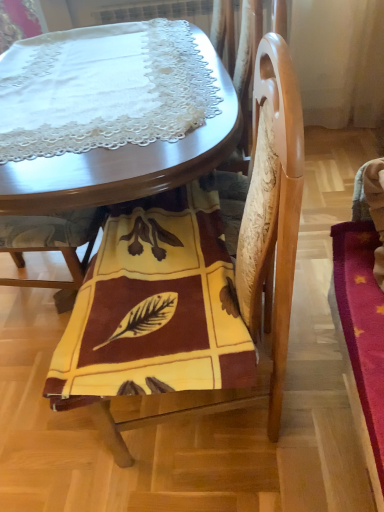
Question: Is yellow fabric chair at center, marked as the first chair in a left-to-right arrangement, located outside yellow fabric at lower center?

Choices:
 (A) yes
 (B) no

Answer: (A)

Question: Can you confirm if yellow fabric chair at center, which appears as the second chair when viewed from the right, is positioned to the right of yellow fabric at lower center?

Choices:
 (A) yes
 (B) no

Answer: (B)

Question: Considering the relative sizes of yellow fabric chair at center, which appears as the second chair when viewed from the right, and yellow fabric at lower center in the image provided, is yellow fabric chair at center, which appears as the second chair when viewed from the right, bigger than yellow fabric at lower center?

Choices:
 (A) no
 (B) yes

Answer: (B)

Question: Can you confirm if yellow fabric chair at center, which appears as the second chair when viewed from the right, is taller than yellow fabric at lower center?

Choices:
 (A) yes
 (B) no

Answer: (A)

Question: Is yellow fabric chair at center, which appears as the second chair when viewed from the right, behind yellow fabric at lower center?

Choices:
 (A) no
 (B) yes

Answer: (B)

Question: In terms of size, does yellow fabric at lower center appear bigger or smaller than wooden table at center?

Choices:
 (A) big
 (B) small

Answer: (B)

Question: From a real-world perspective, relative to wooden table at center, is yellow fabric at lower center vertically above or below?

Choices:
 (A) below
 (B) above

Answer: (B)

Question: Considering the positions of yellow fabric at lower center and wooden table at center in the image, is yellow fabric at lower center wider or thinner than wooden table at center?

Choices:
 (A) thin
 (B) wide

Answer: (A)

Question: Considering their positions, is yellow fabric at lower center located in front of or behind wooden table at center?

Choices:
 (A) behind
 (B) front

Answer: (B)

Question: Considering their positions, is yellow woolen blanket at center, which is the 2th chair from left to right, located in front of or behind yellow fabric chair at center, marked as the first chair in a left-to-right arrangement?

Choices:
 (A) behind
 (B) front

Answer: (B)

Question: Considering the relative positions of yellow woolen blanket at center, which is the 2th chair from left to right, and yellow fabric chair at center, which appears as the second chair when viewed from the right, in the image provided, is yellow woolen blanket at center, which is the 2th chair from left to right, to the left or to the right of yellow fabric chair at center, which appears as the second chair when viewed from the right,?

Choices:
 (A) right
 (B) left

Answer: (A)

Question: From the image's perspective, relative to yellow fabric chair at center, which appears as the second chair when viewed from the right, is yellow woolen blanket at center, which is the 2th chair from left to right, above or below?

Choices:
 (A) below
 (B) above

Answer: (A)

Question: Considering the positions of point (97, 326) and point (29, 248), is point (97, 326) closer or farther from the camera than point (29, 248)?

Choices:
 (A) closer
 (B) farther

Answer: (A)

Question: From the image's perspective, is yellow fabric chair at center, which appears as the second chair when viewed from the right, positioned above or below yellow fabric at lower center?

Choices:
 (A) above
 (B) below

Answer: (A)

Question: Is yellow fabric chair at center, which appears as the second chair when viewed from the right, inside the boundaries of yellow fabric at lower center, or outside?

Choices:
 (A) outside
 (B) inside

Answer: (A)